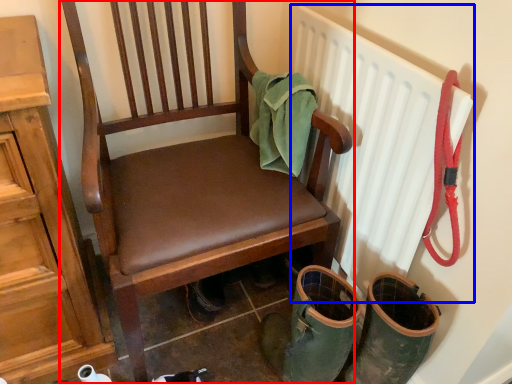
Question: Which object appears farthest to the camera in this image, chair (highlighted by a red box) or radiator (highlighted by a blue box)?

Choices:
 (A) chair
 (B) radiator

Answer: (B)